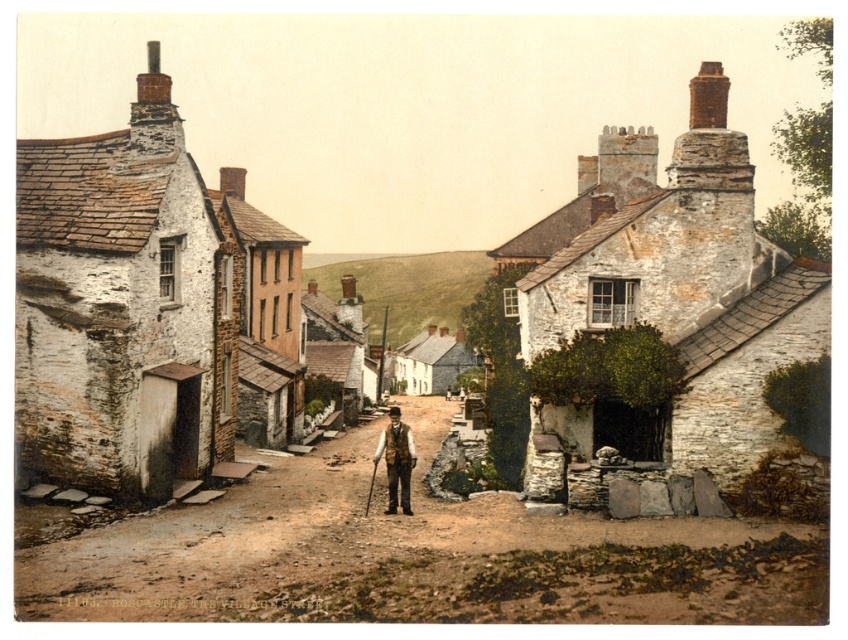
Question: Is brown stone alley at center positioned before stone houses at center?

Choices:
 (A) no
 (B) yes

Answer: (B)

Question: Which object appears closest to the camera in this image?

Choices:
 (A) stone houses at center
 (B) brown leather vest at center

Answer: (A)

Question: Which object is the closest to the brown stone alley at center?

Choices:
 (A) brown leather vest at center
 (B) stone houses at center

Answer: (A)

Question: Can you confirm if brown stone alley at center is positioned to the right of brown leather vest at center?

Choices:
 (A) no
 (B) yes

Answer: (B)

Question: Can you confirm if brown stone alley at center is positioned below stone houses at center?

Choices:
 (A) yes
 (B) no

Answer: (A)

Question: Which point is farther from the camera taking this photo?

Choices:
 (A) (201, 573)
 (B) (389, 445)

Answer: (B)